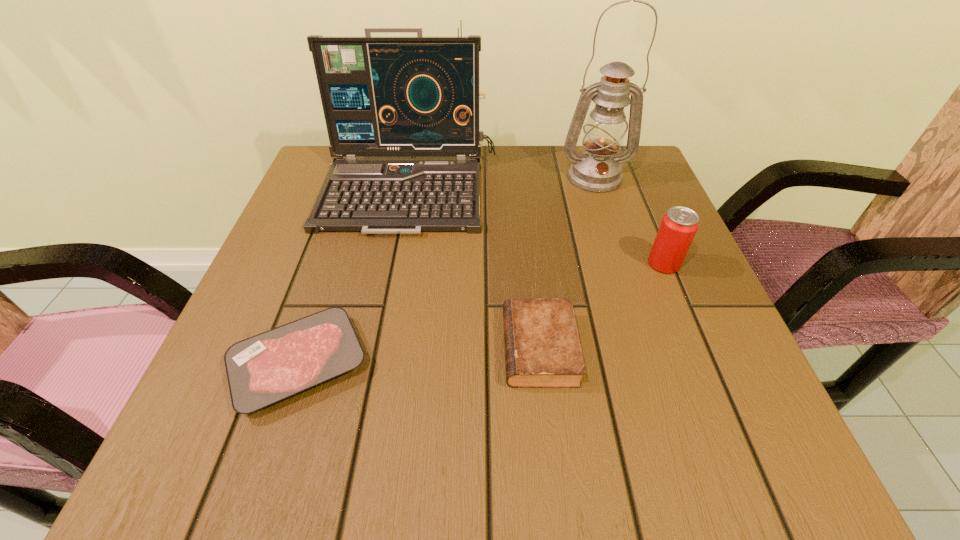
Identify the location of oil lamp. (598, 170).

Find the location of `the fourth shortest object`. the fourth shortest object is located at coordinates (381, 96).

You are a GUI agent. You are given a task and a screenshot of the screen. Output one action in this format:
    pyautogui.click(x=<x>, y=<y>)
    Task: Click on the third farthest object
    Image resolution: width=960 pixels, height=540 pixels.
    Given the screenshot: What is the action you would take?
    pyautogui.click(x=679, y=225)

You are a GUI agent. You are given a task and a screenshot of the screen. Output one action in this format:
    pyautogui.click(x=<x>, y=<y>)
    Task: Click on the third tallest object
    
    Given the screenshot: What is the action you would take?
    pyautogui.click(x=679, y=225)

Locate an element on the screen. The height and width of the screenshot is (540, 960). the fourth tallest object is located at coordinates (542, 348).

In order to click on diary in this screenshot , I will do `click(542, 348)`.

You are a GUI agent. You are given a task and a screenshot of the screen. Output one action in this format:
    pyautogui.click(x=<x>, y=<y>)
    Task: Click on the steak
    The height and width of the screenshot is (540, 960).
    Given the screenshot: What is the action you would take?
    pyautogui.click(x=264, y=369)

The image size is (960, 540). Identify the location of vacant position located on the left of the oil lamp. (422, 177).

At what (x,y) coordinates should I click in order to perform the action: click on free location located 0.140m on the front-facing side of the laptop computer. Please return your answer as a coordinate pair (x, y). The height and width of the screenshot is (540, 960). Looking at the image, I should click on (392, 287).

Image resolution: width=960 pixels, height=540 pixels. What are the coordinates of `free point located on the back of the can` in the screenshot? It's located at (638, 202).